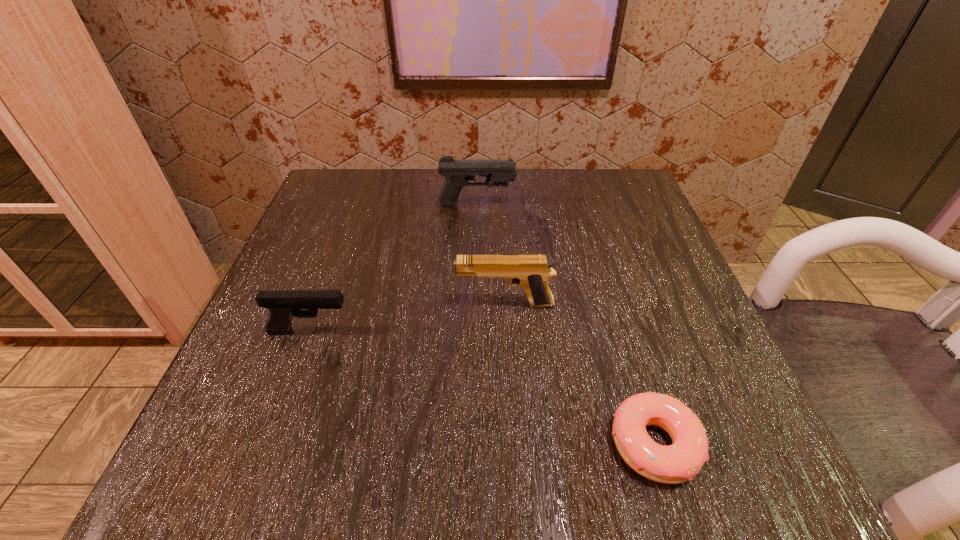
Locate an element on the screen. vacant area that lies between the nearest pistol and the third nearest object is located at coordinates (408, 318).

The height and width of the screenshot is (540, 960). Identify the location of unoccupied area between the second nearest pistol and the nearest pistol. (408, 318).

Identify the location of vacant area that lies between the second farthest object and the shortest pistol. (408, 318).

This screenshot has height=540, width=960. I want to click on vacant space that's between the farthest object and the shortest object, so click(x=565, y=325).

The height and width of the screenshot is (540, 960). What are the coordinates of `the closest object relative to the farthest object` in the screenshot? It's located at (531, 272).

Select which object is the closest to the shortest object. Please provide its 2D coordinates. Your answer should be formatted as a tuple, i.e. [(x, y)], where the tuple contains the x and y coordinates of a point satisfying the conditions above.

[(531, 272)]

Select which pistol appears as the second closest to the doughnut. Please provide its 2D coordinates. Your answer should be formatted as a tuple, i.e. [(x, y)], where the tuple contains the x and y coordinates of a point satisfying the conditions above.

[(283, 304)]

This screenshot has width=960, height=540. I want to click on the second closest pistol to the nearest object, so click(x=283, y=304).

What are the coordinates of `vacant space that satisfies the following two spatial constraints: 1. at the barrel of the rightmost object; 2. on the right side of the farthest object` in the screenshot? It's located at (474, 444).

The image size is (960, 540). Find the location of `vacant region that satisfies the following two spatial constraints: 1. at the barrel of the second farthest pistol; 2. on the back side of the doughnut`. vacant region that satisfies the following two spatial constraints: 1. at the barrel of the second farthest pistol; 2. on the back side of the doughnut is located at coordinates (513, 444).